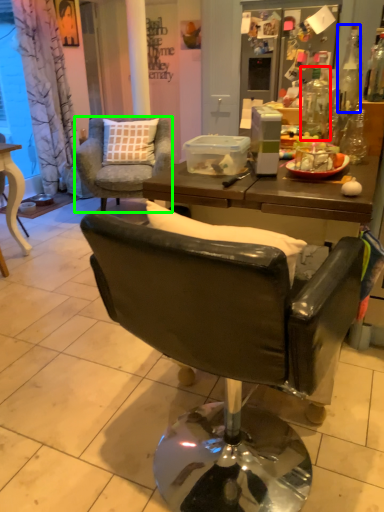
Question: Which object is positioned closest to bottle (highlighted by a red box)? Select from bottle (highlighted by a blue box) and chair (highlighted by a green box).

Choices:
 (A) bottle
 (B) chair

Answer: (B)